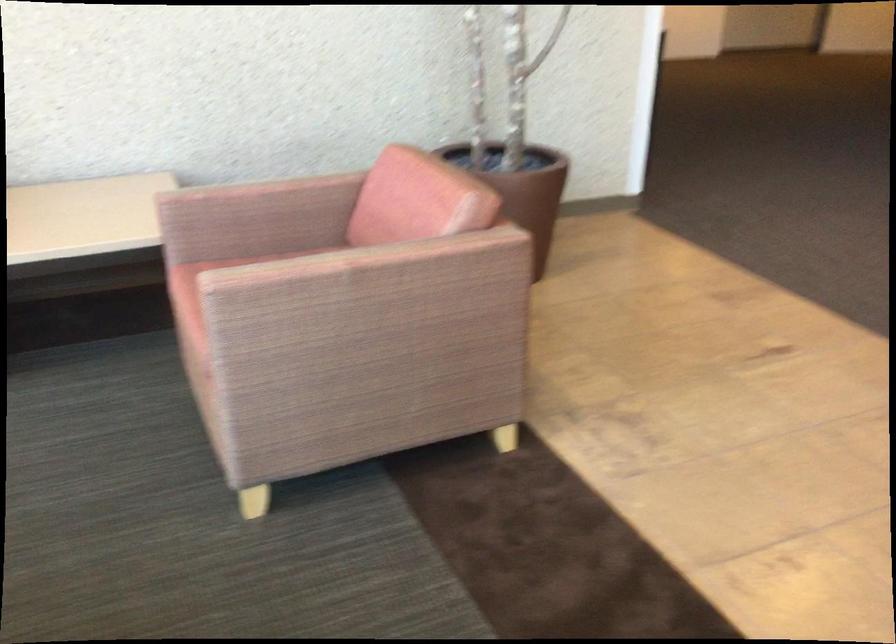
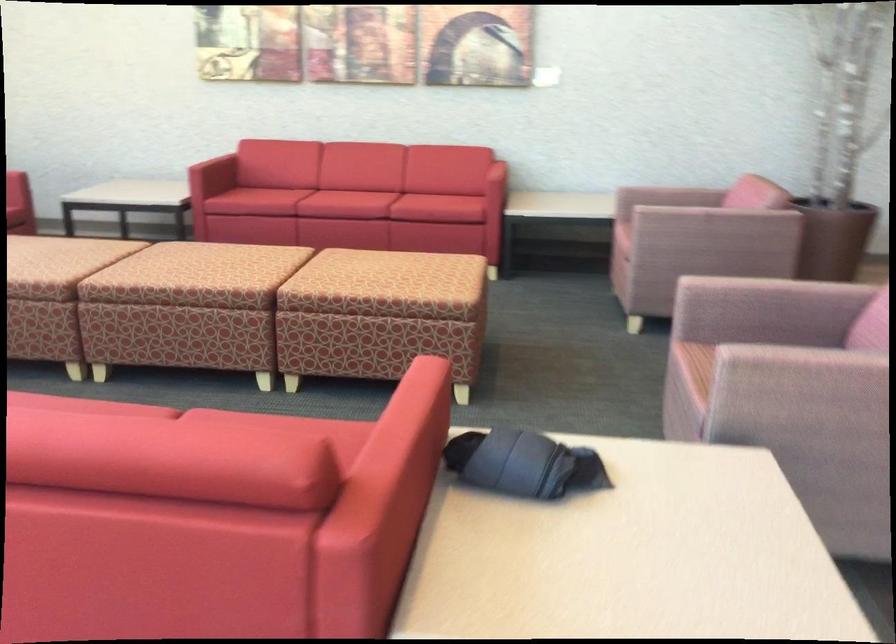
In the second image, find the point that corresponds to (191,297) in the first image.

(624, 218)